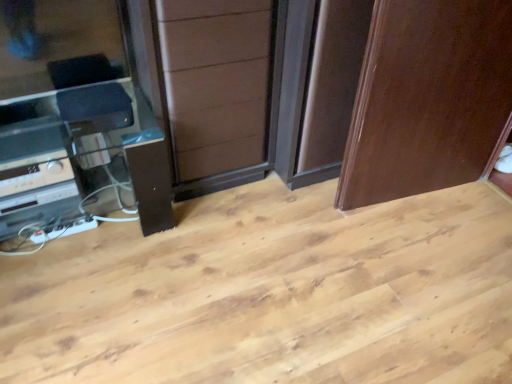
Question: Does brown wood screen door at center have a lesser height compared to glossy wood door at upper right?

Choices:
 (A) no
 (B) yes

Answer: (B)

Question: From a real-world perspective, is brown wood screen door at center physically below glossy wood door at upper right?

Choices:
 (A) no
 (B) yes

Answer: (B)

Question: Can you confirm if brown wood screen door at center is wider than glossy wood door at upper right?

Choices:
 (A) yes
 (B) no

Answer: (A)

Question: From a real-world perspective, is brown wood screen door at center over glossy wood door at upper right?

Choices:
 (A) yes
 (B) no

Answer: (B)

Question: Is brown wood screen door at center placed right next to glossy wood door at upper right?

Choices:
 (A) no
 (B) yes

Answer: (A)

Question: Could you tell me if brown wood screen door at center is facing glossy wood door at upper right?

Choices:
 (A) yes
 (B) no

Answer: (B)

Question: Would you say satin black stereo at lower left is outside brown wood screen door at center?

Choices:
 (A) yes
 (B) no

Answer: (A)

Question: Can you confirm if satin black stereo at lower left is positioned to the left of brown wood screen door at center?

Choices:
 (A) no
 (B) yes

Answer: (B)

Question: From a real-world perspective, does satin black stereo at lower left stand above brown wood screen door at center?

Choices:
 (A) yes
 (B) no

Answer: (B)

Question: Is satin black stereo at lower left thinner than brown wood screen door at center?

Choices:
 (A) no
 (B) yes

Answer: (B)

Question: Is brown wood screen door at center at the back of satin black stereo at lower left?

Choices:
 (A) yes
 (B) no

Answer: (B)

Question: Could you tell me if satin black stereo at lower left is facing brown wood screen door at center?

Choices:
 (A) no
 (B) yes

Answer: (A)

Question: Can you confirm if brown wood screen door at center is taller than satin black entertainment center at left?

Choices:
 (A) yes
 (B) no

Answer: (A)